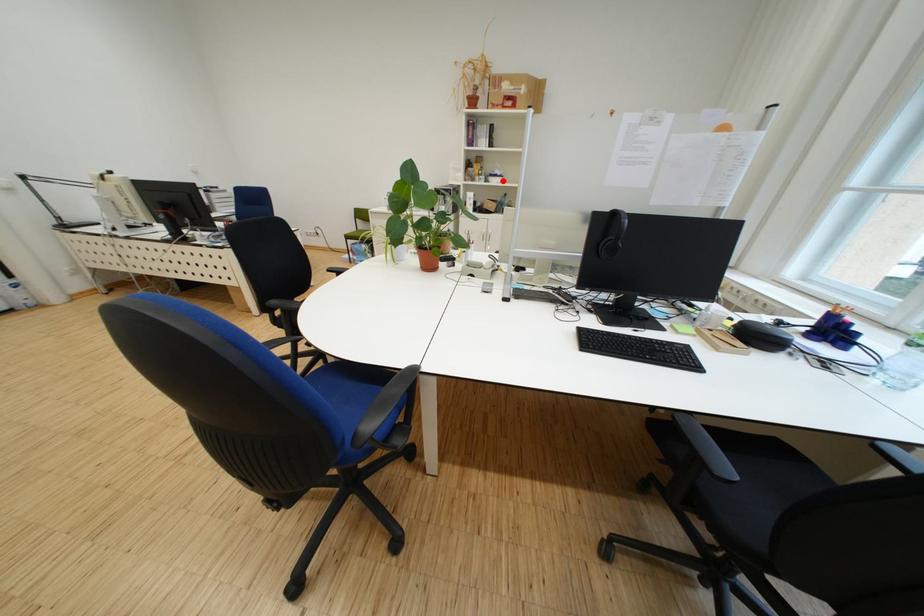
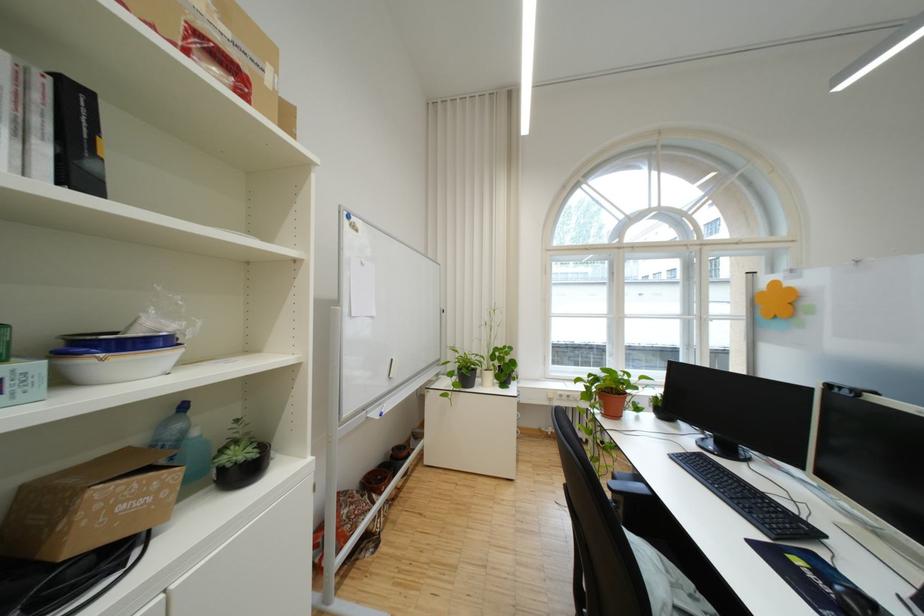
Question: I am providing you with two images of the same scene from different viewpoints. A red point is shown in image1. For the corresponding object point in image2, is it positioned nearer or farther from the camera?

Choices:
 (A) Nearer
 (B) Farther

Answer: (B)